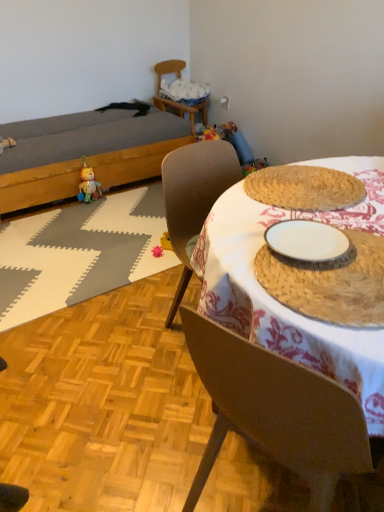
The image size is (384, 512). I want to click on vacant point to the left of pink rubber toy at center, positioned as the first toy in bottom-to-top order, so click(132, 256).